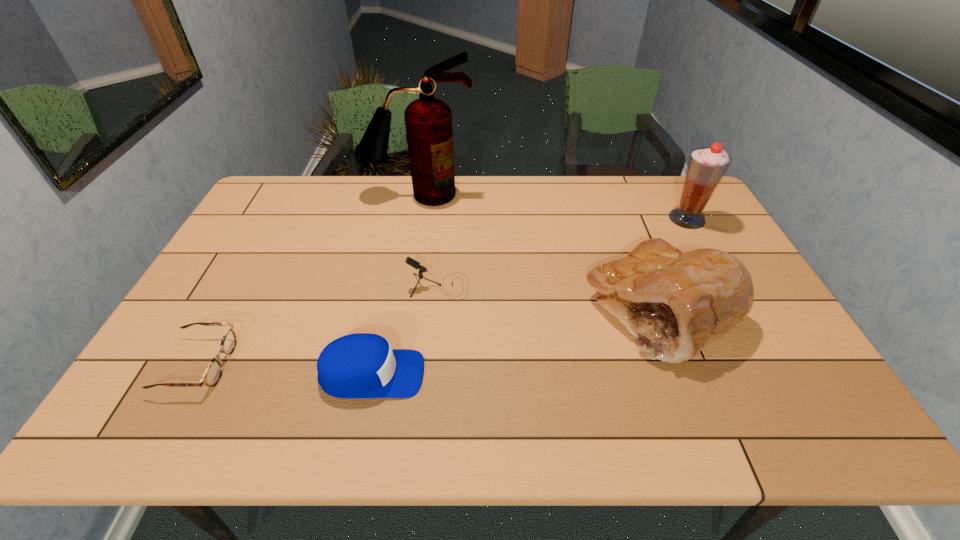
This screenshot has height=540, width=960. In order to click on vacant area situated 0.120m on the left of the smoothie in this screenshot , I will do `click(634, 219)`.

This screenshot has width=960, height=540. Identify the location of free space located 0.290m on the filling side of the bread. (477, 311).

Where is `vacant space situated 0.360m on the filling side of the bread`? The image size is (960, 540). vacant space situated 0.360m on the filling side of the bread is located at coordinates (451, 311).

Locate an element on the screen. The image size is (960, 540). vacant region located on the filling side of the bread is located at coordinates (564, 311).

Image resolution: width=960 pixels, height=540 pixels. I want to click on free region located 0.360m on the stand of the microphone, so click(x=596, y=286).

Where is `vacant space positioned on the front-facing side of the baseball cap`? vacant space positioned on the front-facing side of the baseball cap is located at coordinates (526, 374).

Image resolution: width=960 pixels, height=540 pixels. I want to click on vacant space situated 0.400m on the frame of the spectacles, so click(396, 364).

This screenshot has height=540, width=960. I want to click on fire extinguisher at the far edge, so click(428, 120).

Where is `smoothie at the far edge`? The height and width of the screenshot is (540, 960). smoothie at the far edge is located at coordinates (706, 167).

This screenshot has height=540, width=960. What are the coordinates of `object that is positioned at the near edge` in the screenshot? It's located at (362, 365).